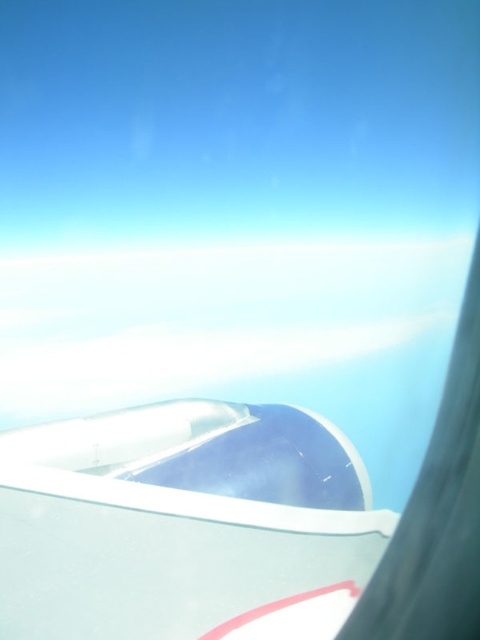
Question: Which point is farther to the camera?

Choices:
 (A) (265, 572)
 (B) (336, 282)

Answer: (B)

Question: Does white glossy airplane wing at upper center have a smaller size compared to white fluffy cloud at upper center?

Choices:
 (A) no
 (B) yes

Answer: (B)

Question: Is the position of white glossy airplane wing at upper center more distant than that of white fluffy cloud at upper center?

Choices:
 (A) no
 (B) yes

Answer: (A)

Question: Which object appears farthest from the camera in this image?

Choices:
 (A) white glossy airplane wing at upper center
 (B) white fluffy cloud at upper center

Answer: (B)

Question: Which point appears farthest from the camera in this image?

Choices:
 (A) (371, 518)
 (B) (391, 333)

Answer: (B)

Question: Is white glossy airplane wing at upper center positioned before white fluffy cloud at upper center?

Choices:
 (A) yes
 (B) no

Answer: (A)